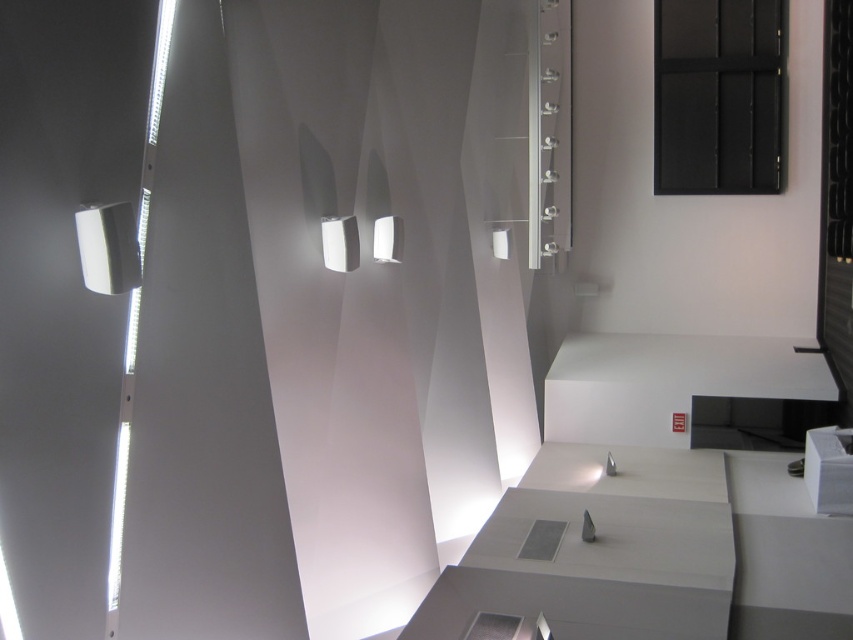
Question: Which point is farther from the camera taking this photo?

Choices:
 (A) (91, 288)
 (B) (376, 260)

Answer: (B)

Question: Is white glossy rectangular light at center positioned in front of white glossy light at center?

Choices:
 (A) yes
 (B) no

Answer: (A)

Question: Is white glossy rectangular light at center thinner than white glossy light at center?

Choices:
 (A) no
 (B) yes

Answer: (A)

Question: Which object is positioned farthest from the white glossy light at center?

Choices:
 (A) white glossy wall sconce at upper left
 (B) white glossy rectangular light at center

Answer: (A)

Question: Which point is closer to the camera taking this photo?

Choices:
 (A) (103, 284)
 (B) (399, 220)

Answer: (A)

Question: Where is white glossy wall sconce at upper left located in relation to white glossy rectangular light at center in the image?

Choices:
 (A) below
 (B) above

Answer: (A)